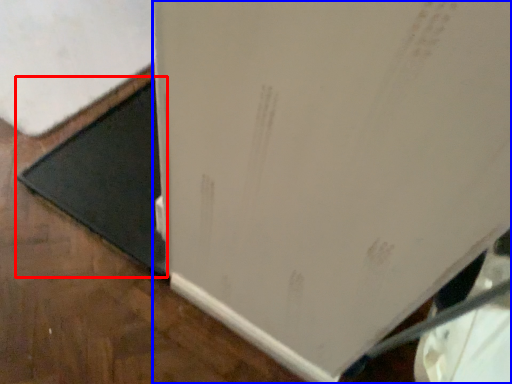
Question: Which object appears farthest to the camera in this image, doormat (highlighted by a red box) or refrigerator (highlighted by a blue box)?

Choices:
 (A) doormat
 (B) refrigerator

Answer: (A)